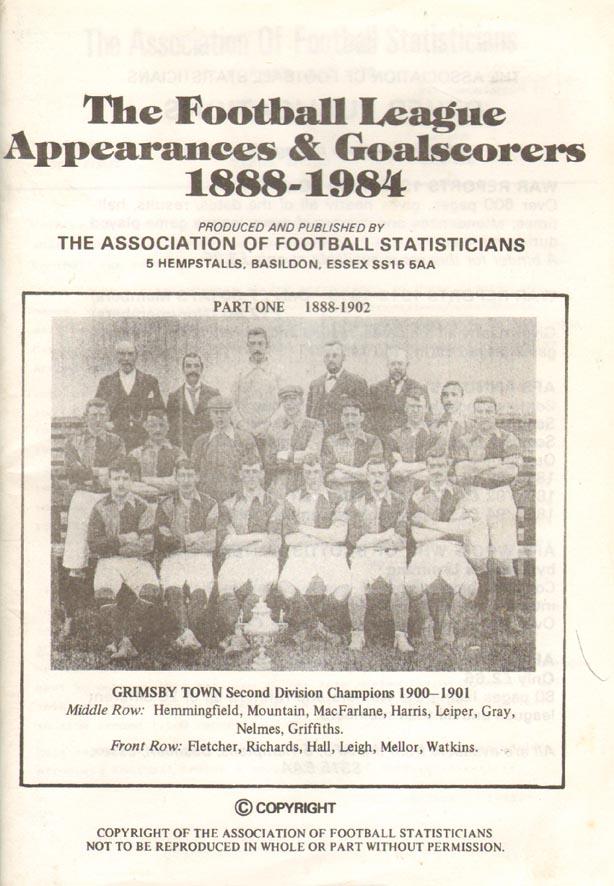
In order to click on trophy in this screenshot , I will do `click(266, 633)`.